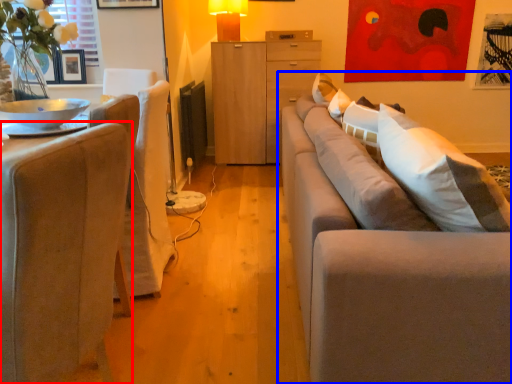
Question: Which point is further to the camera, chair (highlighted by a red box) or studio couch (highlighted by a blue box)?

Choices:
 (A) chair
 (B) studio couch

Answer: (B)